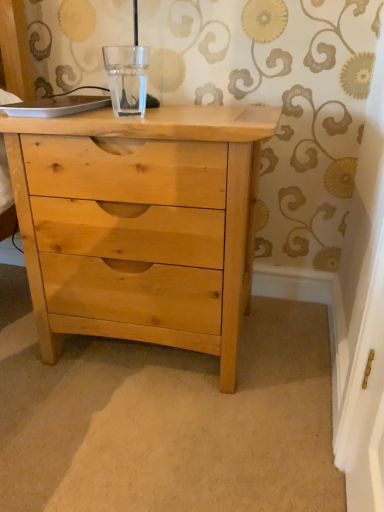
Question: Which is correct: transparent glass at center is inside natural wood chest of drawers at center, or outside of it?

Choices:
 (A) outside
 (B) inside

Answer: (A)

Question: From a real-world perspective, relative to natural wood chest of drawers at center, is transparent glass at center vertically above or below?

Choices:
 (A) above
 (B) below

Answer: (A)

Question: Relative to natural wood chest of drawers at center, is transparent glass at center in front or behind?

Choices:
 (A) front
 (B) behind

Answer: (B)

Question: In the image, is natural wood chest of drawers at center positioned in front of or behind transparent glass at center?

Choices:
 (A) front
 (B) behind

Answer: (A)

Question: Is point (170, 112) closer or farther from the camera than point (142, 103)?

Choices:
 (A) closer
 (B) farther

Answer: (B)

Question: Is natural wood chest of drawers at center spatially inside transparent glass at center, or outside of it?

Choices:
 (A) outside
 (B) inside

Answer: (A)

Question: From the image's perspective, is natural wood chest of drawers at center above or below transparent glass at center?

Choices:
 (A) above
 (B) below

Answer: (B)